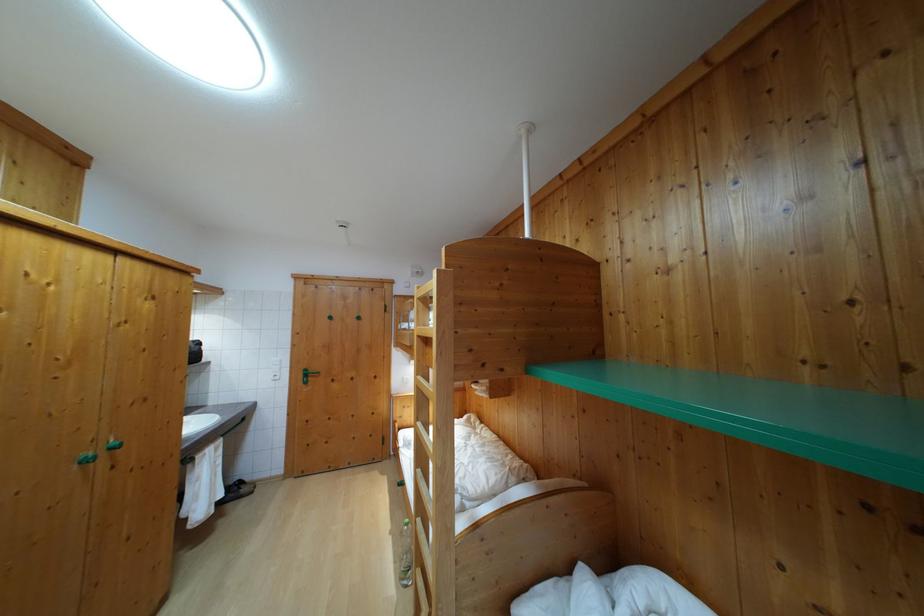
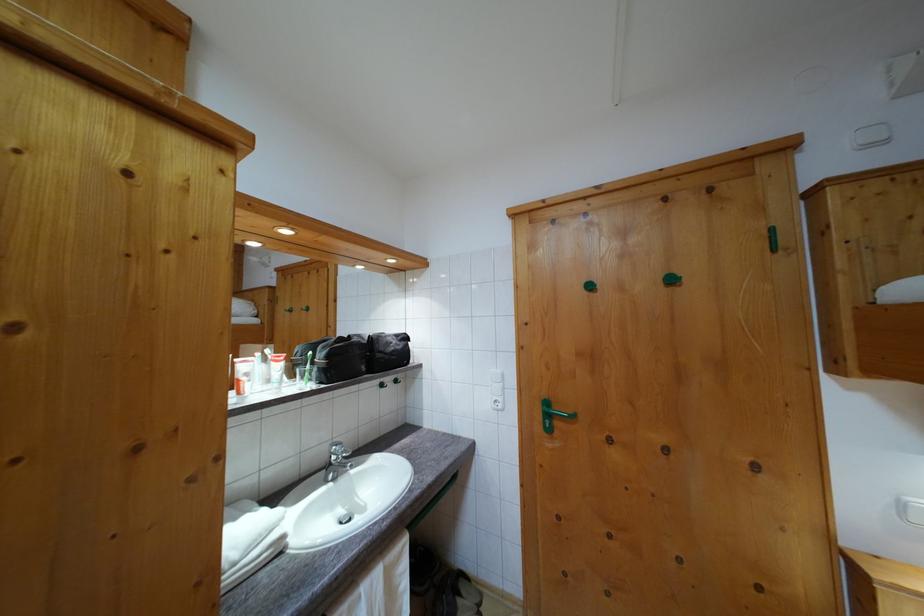
In the second image, find the point that corresponds to (362,325) in the first image.

(675, 286)